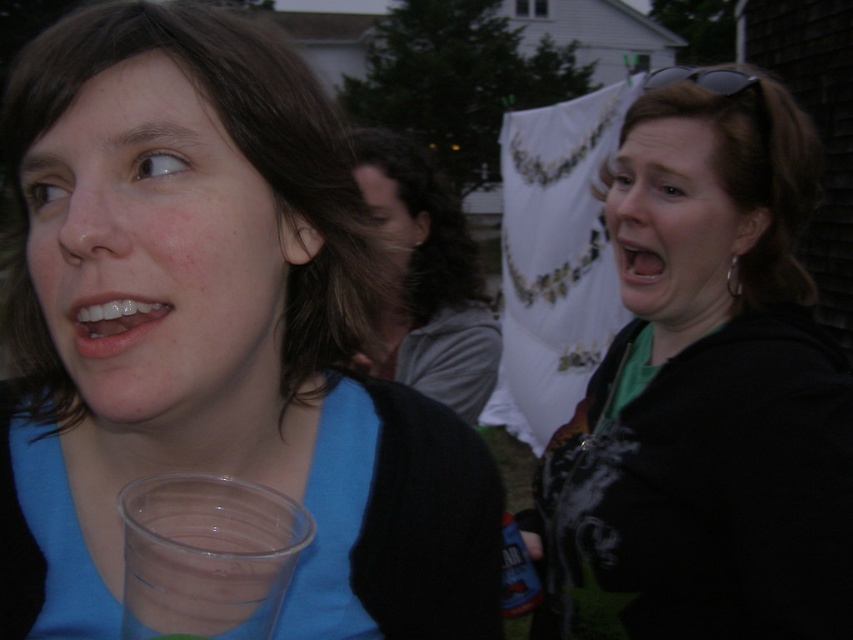
Measure the distance between blue matte shirt at upper left and dark gray hair at center.

A distance of 3.47 feet exists between blue matte shirt at upper left and dark gray hair at center.

Can you confirm if blue matte shirt at upper left is positioned to the left of dark gray hair at center?

Indeed, blue matte shirt at upper left is positioned on the left side of dark gray hair at center.

Where is `blue matte shirt at upper left`? blue matte shirt at upper left is located at coordinates (218, 332).

I want to click on blue matte shirt at upper left, so click(218, 332).

Does white glossy teeth at lower left lie in front of smooth glossy mouth at center right?

Yes, it is.

Is white glossy teeth at lower left behind smooth glossy mouth at center right?

That is False.

Is point (138, 320) farther from camera compared to point (653, 266)?

That is False.

Where is `white glossy teeth at lower left`? The height and width of the screenshot is (640, 853). white glossy teeth at lower left is located at coordinates (113, 321).

Based on the photo, can you confirm if dark gray hair at center is positioned to the right of smooth glossy mouth at center right?

Incorrect, dark gray hair at center is not on the right side of smooth glossy mouth at center right.

Does dark gray hair at center have a lesser height compared to smooth glossy mouth at center right?

No, dark gray hair at center is not shorter than smooth glossy mouth at center right.

The image size is (853, 640). What do you see at coordinates (428, 275) in the screenshot?
I see `dark gray hair at center` at bounding box center [428, 275].

The width and height of the screenshot is (853, 640). I want to click on dark gray hair at center, so click(x=428, y=275).